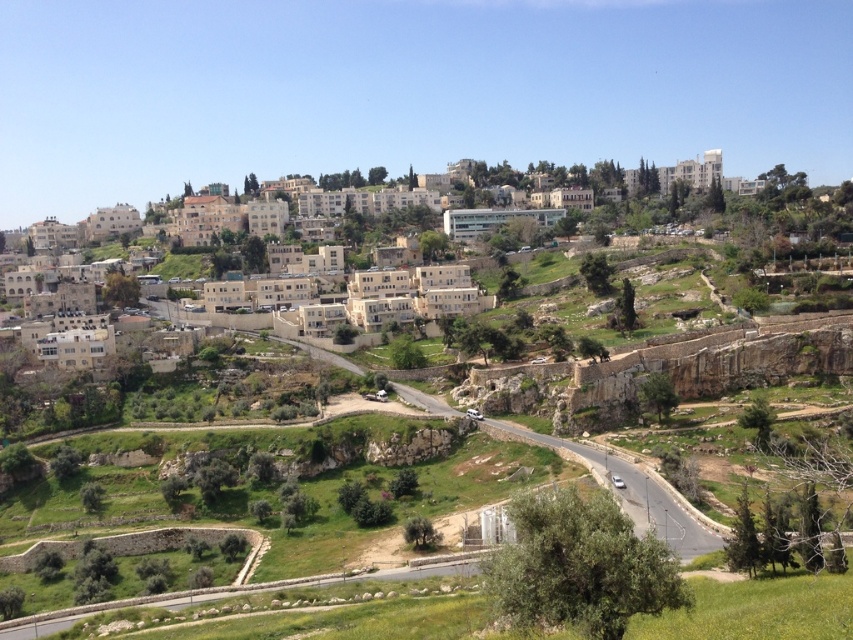
Consider the image. You are hiking on the green grassy mountain path at center and want to reach the beige stone buildings at upper center. Which direction should you head relative to the path?

The beige stone buildings at upper center are positioned on the right side of the green grassy mountain path at center, so you should head to the right relative to the path.

You are standing at the bottom of the hill looking up at the beige stone buildings at upper center. What is their exact 2D coordinate location in the image?

The beige stone buildings at upper center are located at the 2D coordinate point of (234, 212).